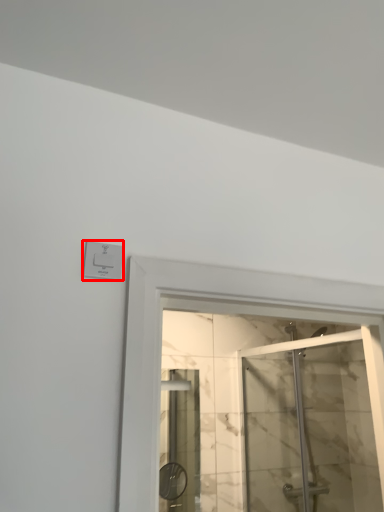
Question: Where is electric outlet (annotated by the red box) located in relation to screen door in the image?

Choices:
 (A) right
 (B) left

Answer: (B)